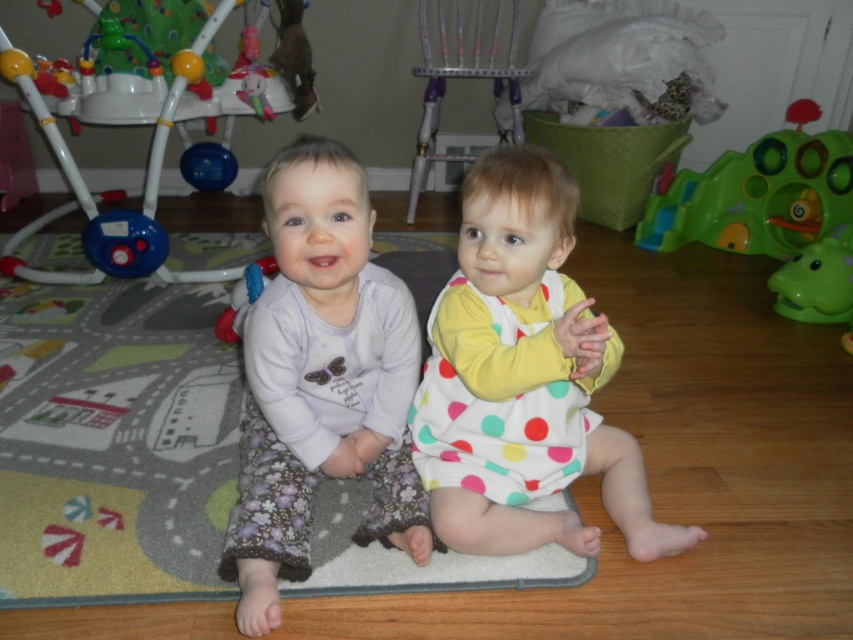
You are a parent trying to choose between placing a new toy on the shelf above the green plastic toy at right or the white plastic baby walker at left. Which object requires a taller shelf?

The white plastic baby walker at left is taller than the green plastic toy at right, so the shelf above the white plastic baby walker at left requires a taller shelf.